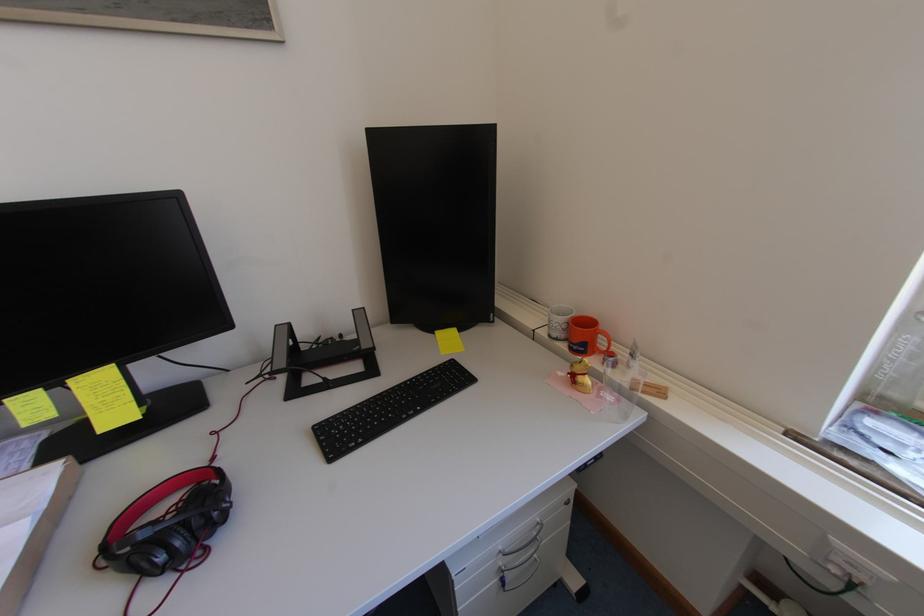
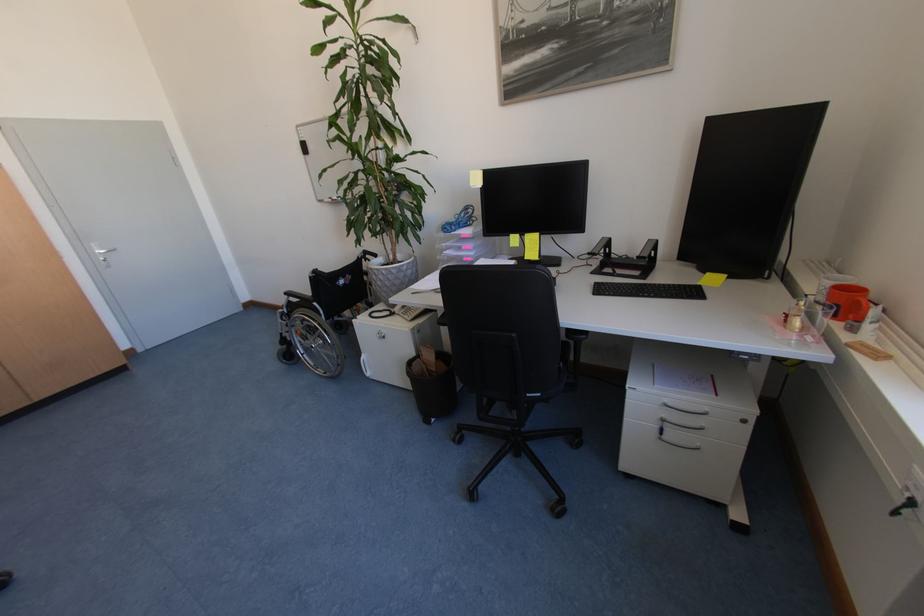
Find the pixel in the second image that matches point (412, 384) in the first image.

(663, 285)